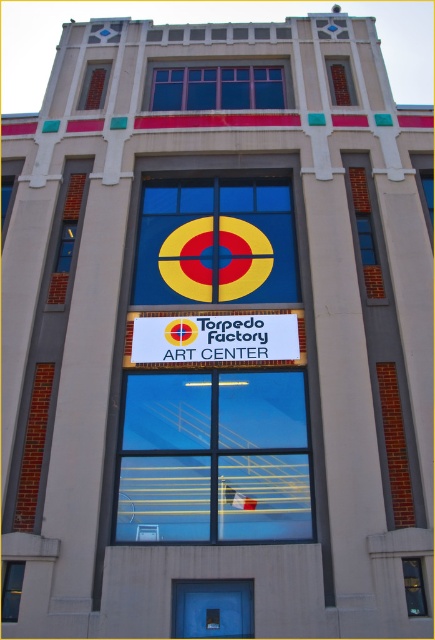
You are standing in front of the Torpedo Factory Art Center and notice two points marked on the building. The first point is at coordinates point (157, 88) and the second is at point (211, 579). Which point is closer to you?

Point (157, 88) is further to the viewer than point (211, 579), so the second point is closer to you.